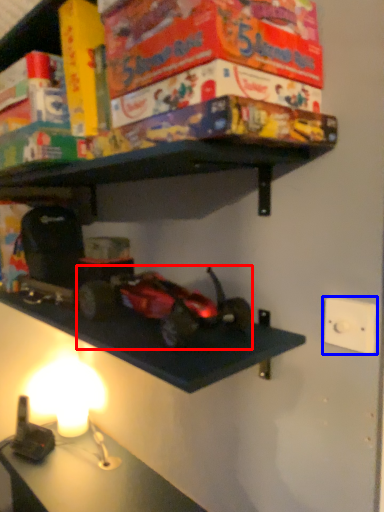
Question: Which object is further to the camera taking this photo, toy (highlighted by a red box) or light switch (highlighted by a blue box)?

Choices:
 (A) toy
 (B) light switch

Answer: (B)